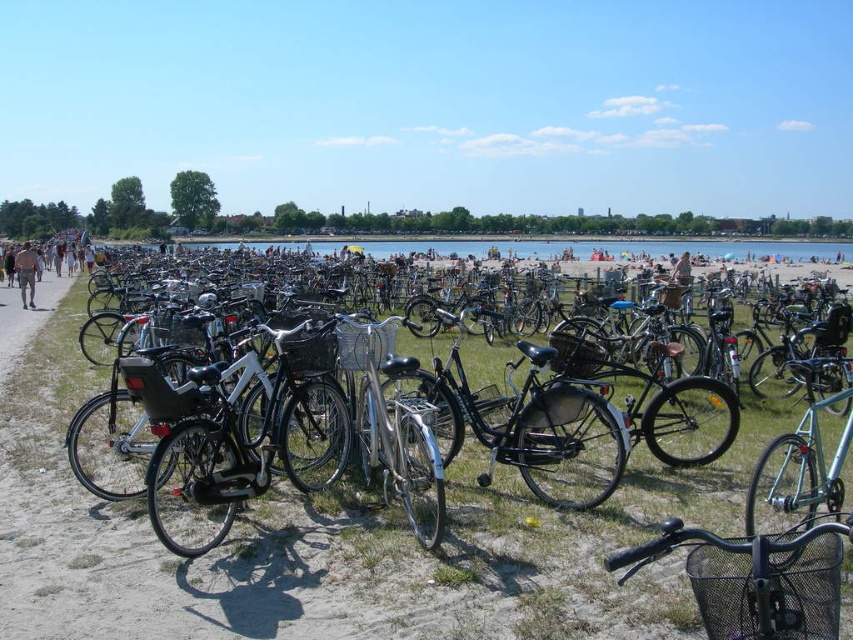
From the picture: You are standing at the edge of the grassy area near the beach and see the black matte bicycle at center and the tan skin person at left. Which object is nearer to you?

The black matte bicycle at center is closer to the viewer than the tan skin person at left, so the black matte bicycle at center is nearer to you.

You are a photographer standing at the edge of the grassy area near the beach. You want to take a photo of the brown leather jacket at left without the black matte bicycle at center blocking it. Is the jacket visible from your current position?

The black matte bicycle at center is in front of the brown leather jacket at left, so the jacket is partially or fully blocked by the bicycle and may not be visible from your current position.